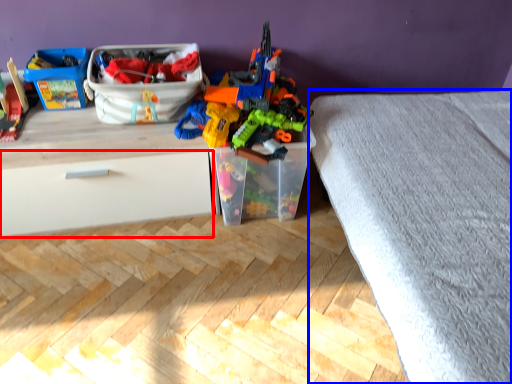
Question: Among these objects, which one is nearest to the camera, drawer (highlighted by a red box) or bed frame (highlighted by a blue box)?

Choices:
 (A) drawer
 (B) bed frame

Answer: (B)